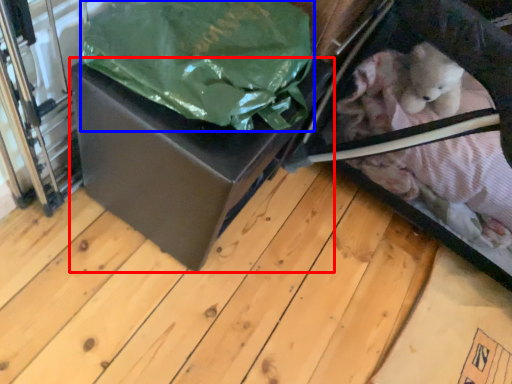
Question: Which point is closer to the camera, box (highlighted by a red box) or plastic bag (highlighted by a blue box)?

Choices:
 (A) box
 (B) plastic bag

Answer: (B)